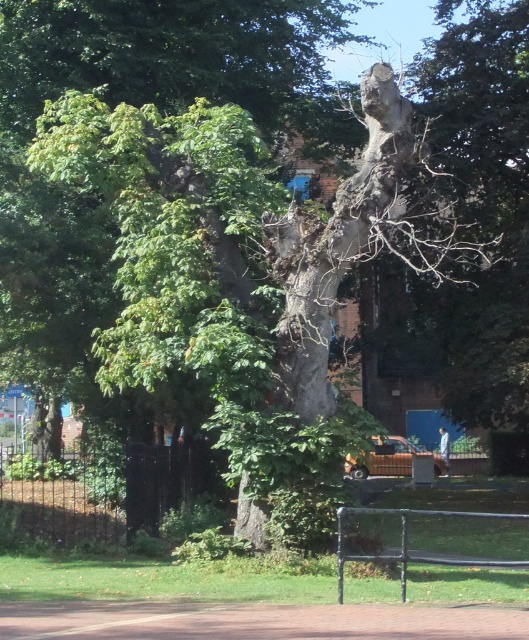
Question: Which point is closer to the camera?

Choices:
 (A) smooth gray tree trunk at center
 (B) black metal park bench at lower center

Answer: (B)

Question: Does smooth gray tree trunk at center have a lesser width compared to black metal park bench at lower center?

Choices:
 (A) yes
 (B) no

Answer: (B)

Question: Which point is closer to the camera taking this photo?

Choices:
 (A) (445, 522)
 (B) (280, 61)

Answer: (A)

Question: In this image, where is smooth gray tree trunk at center located relative to black metal park bench at lower center?

Choices:
 (A) right
 (B) left

Answer: (B)

Question: Does smooth gray tree trunk at center appear on the left side of black metal park bench at lower center?

Choices:
 (A) no
 (B) yes

Answer: (B)